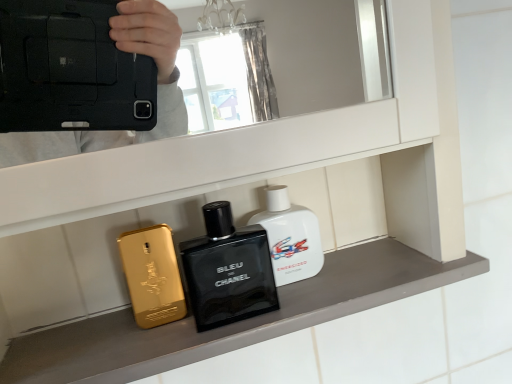
Question: From a real-world perspective, relative to black glass perfume at center, is white glossy bottle at center, the 2th perfume in the left-to-right sequence, vertically above or below?

Choices:
 (A) above
 (B) below

Answer: (A)

Question: Considering the relative positions of white glossy bottle at center, the 2th perfume in the left-to-right sequence, and black glass perfume at center in the image provided, is white glossy bottle at center, the 2th perfume in the left-to-right sequence, to the left or to the right of black glass perfume at center?

Choices:
 (A) right
 (B) left

Answer: (A)

Question: Which of these objects is positioned farthest from the gold metallic phone at left, positioned as the first perfume in left-to-right order?

Choices:
 (A) white glossy bottle at center, the first perfume positioned from the right
 (B) black glass perfume at center
 (C) metallic gold phone at center

Answer: (A)

Question: Estimate the real-world distances between objects in this image. Which object is farther from the metallic gold phone at center?

Choices:
 (A) gold metallic phone at left, positioned as the first perfume in left-to-right order
 (B) black glass perfume at center
 (C) white glossy bottle at center, the first perfume positioned from the right

Answer: (C)